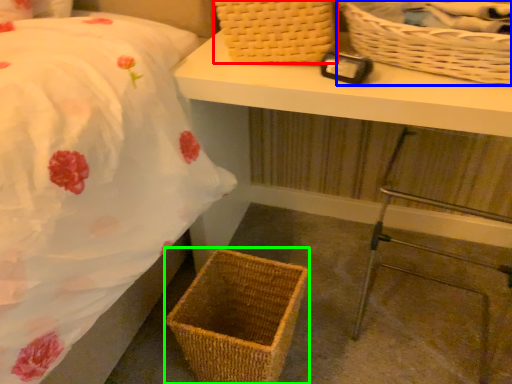
Question: Which object is positioned farthest from picnic basket (highlighted by a red box)? Select from picnic basket (highlighted by a blue box) and picnic basket (highlighted by a green box).

Choices:
 (A) picnic basket
 (B) picnic basket

Answer: (B)